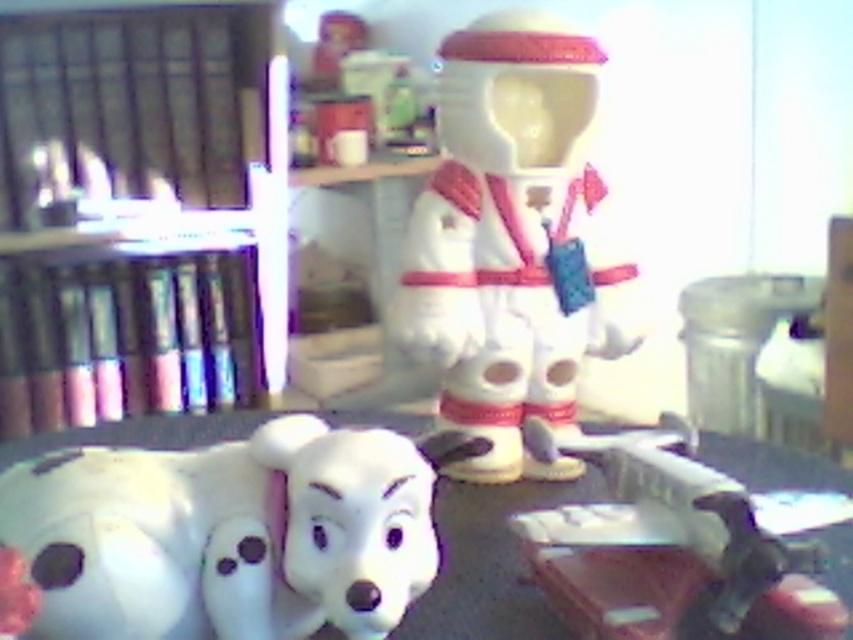
Question: Which point appears closest to the camera in this image?

Choices:
 (A) pos(3,445)
 (B) pos(273,244)
 (C) pos(468,298)

Answer: (C)

Question: Can you confirm if white glossy astronaut at center is thinner than white plastic table at lower center?

Choices:
 (A) no
 (B) yes

Answer: (B)

Question: Can you confirm if white glossy astronaut at center is bigger than white plastic table at lower center?

Choices:
 (A) no
 (B) yes

Answer: (A)

Question: Considering the real-world distances, which object is farthest from the white glossy astronaut at center?

Choices:
 (A) white plastic table at lower center
 (B) metallic black bookshelf at left

Answer: (B)

Question: From the image, what is the correct spatial relationship of metallic black bookshelf at left in relation to white plastic table at lower center?

Choices:
 (A) right
 (B) left

Answer: (B)

Question: Which point is farther to the camera?

Choices:
 (A) metallic black bookshelf at left
 (B) white glossy astronaut at center

Answer: (A)